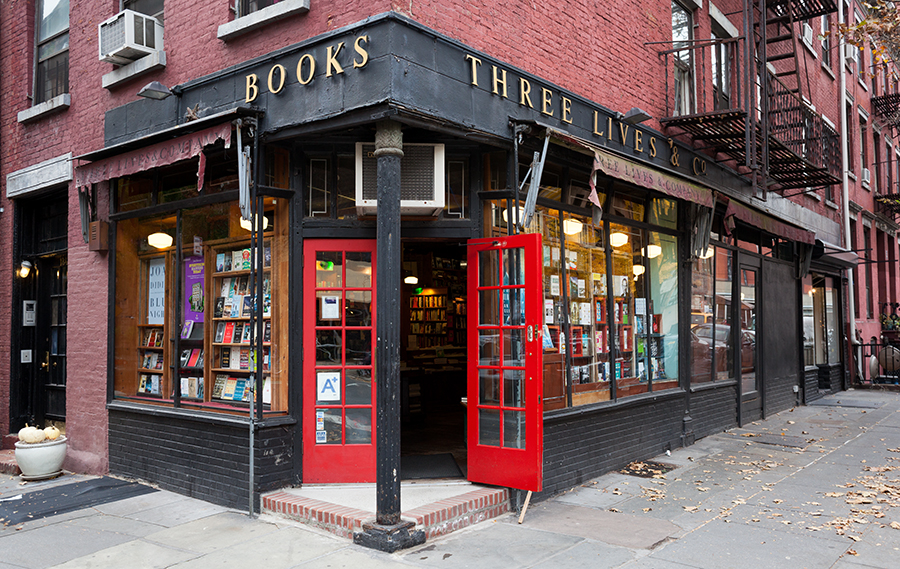
At what (x,y) coordinates should I click in order to perform the action: click on left brick wall. Please return your answer as a coordinate pair (x, y). Looking at the image, I should click on (102, 313).